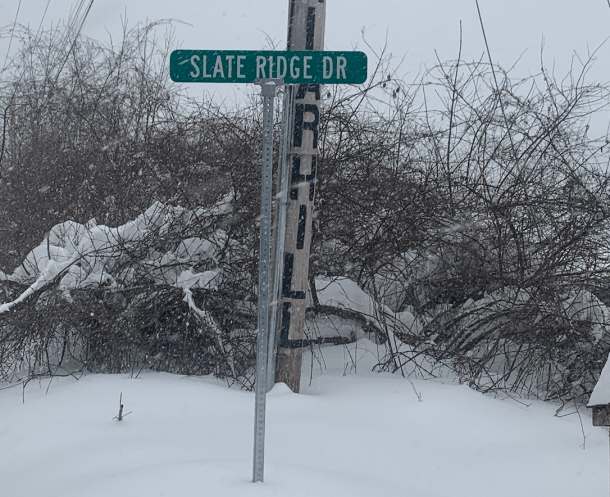
Where is `wires`? wires is located at coordinates (74, 41).